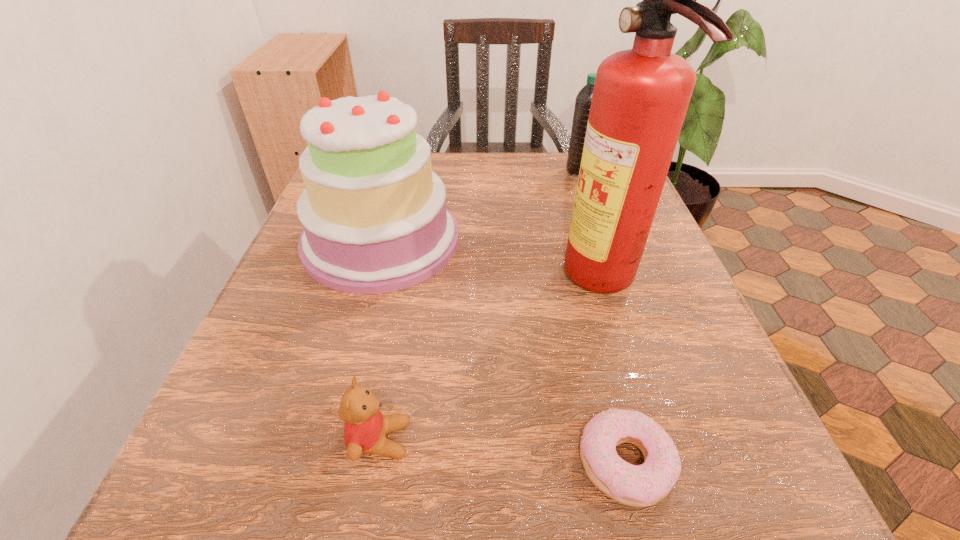
The width and height of the screenshot is (960, 540). I want to click on free spot located 0.360m on the left of the water bottle, so click(x=420, y=171).

Locate an element on the screen. This screenshot has height=540, width=960. free region located on the front-facing side of the fourth tallest object is located at coordinates (526, 440).

At what (x,y) coordinates should I click in order to perform the action: click on free space located 0.380m on the back of the doughnut. Please return your answer as a coordinate pair (x, y). The image size is (960, 540). Looking at the image, I should click on (570, 244).

Find the location of a particular element. Image resolution: width=960 pixels, height=540 pixels. cake situated at the far edge is located at coordinates (374, 214).

You are a GUI agent. You are given a task and a screenshot of the screen. Output one action in this format:
    pyautogui.click(x=<x>, y=<y>)
    Task: Click on the water bottle situated at the far edge
    
    Given the screenshot: What is the action you would take?
    pyautogui.click(x=583, y=99)

I want to click on teddy bear that is at the near edge, so click(x=365, y=429).

Locate an element on the screen. doughnut that is positioned at the near edge is located at coordinates (643, 485).

Where is `object present at the left edge`? object present at the left edge is located at coordinates (374, 214).

At what (x,y) coordinates should I click in order to perform the action: click on fire extinguisher located in the right edge section of the desktop. Please return your answer as a coordinate pair (x, y). Looking at the image, I should click on (641, 95).

Where is `water bottle positioned at the right edge`? water bottle positioned at the right edge is located at coordinates (x=583, y=99).